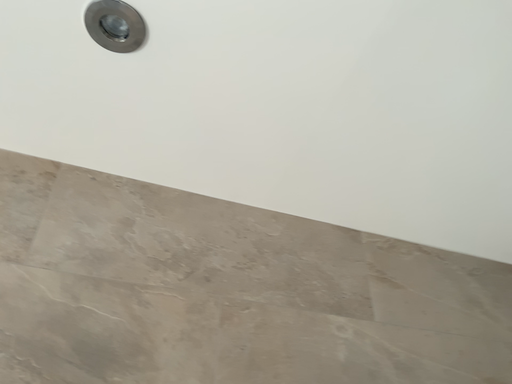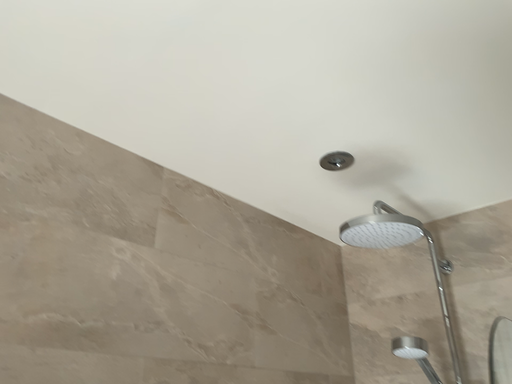
Question: How did the camera likely rotate when shooting the video?

Choices:
 (A) rotated downward
 (B) rotated upward

Answer: (A)